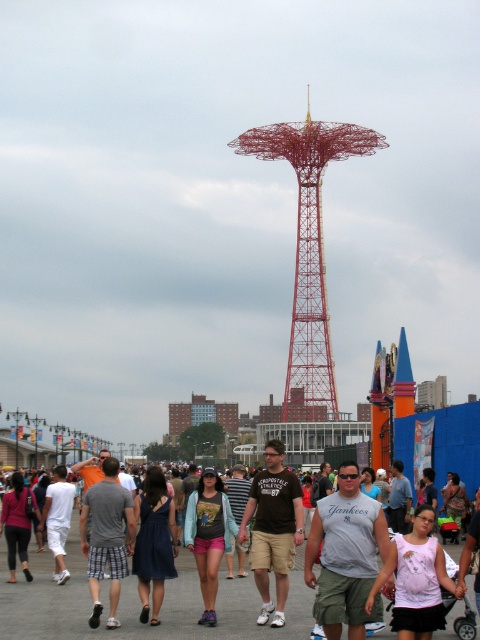
You are a photographer standing at the center of the fairground. You want to capture a photo of the crowd while ensuring the matte black tank top at center is positioned exactly at point (140, 604). Is this possible given the current arrangement?

Yes, the matte black tank top at center is already located at point (140, 604), so positioning it there in the photo is feasible.

You are standing at the point marked by the coordinates point [274,529] in the image. What object are you currently standing on?

You are standing on the brown cotton t shirt at center.